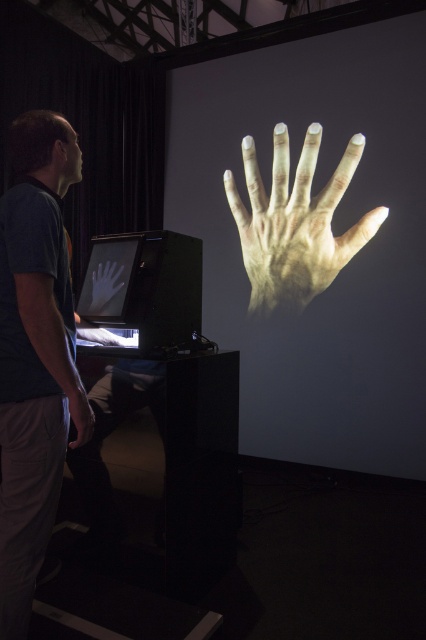
Question: Among these points, which one is nearest to the camera?

Choices:
 (A) (89, 436)
 (B) (313, 230)

Answer: (A)

Question: Is dark blue shirt at center below translucent skin hand at lower left?

Choices:
 (A) yes
 (B) no

Answer: (B)

Question: Which of these objects is positioned closest to the dark blue shirt at center?

Choices:
 (A) translucent skin hand at lower left
 (B) matte white hand at center
 (C) light beige skin at center

Answer: (A)

Question: Does dark blue shirt at center have a larger size compared to light beige skin at center?

Choices:
 (A) no
 (B) yes

Answer: (A)

Question: In this image, where is dark blue shirt at center located relative to light beige skin at center?

Choices:
 (A) left
 (B) right

Answer: (A)

Question: Based on their relative distances, which object is nearer to the dark blue shirt at center?

Choices:
 (A) translucent skin hand at lower left
 (B) matte black hand at center
 (C) matte white hand at center

Answer: (A)